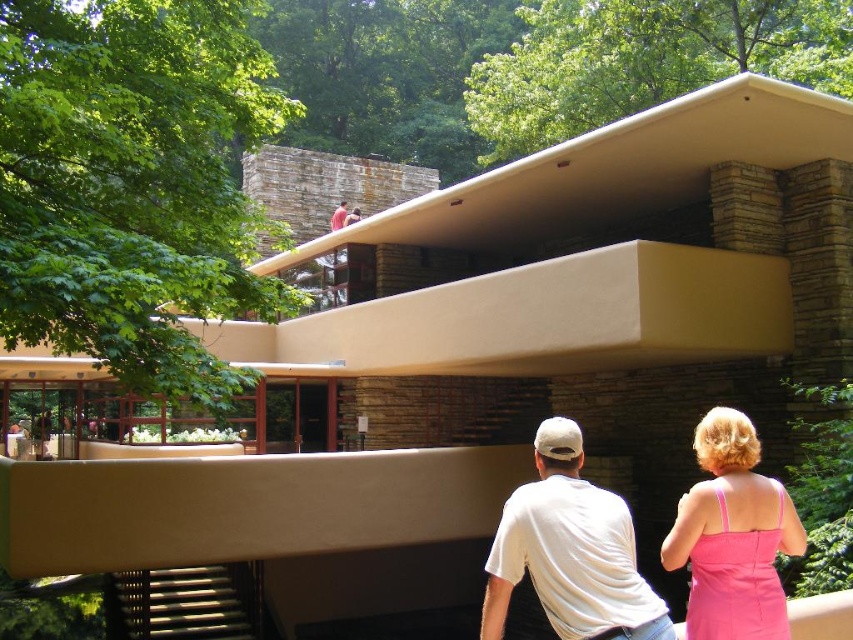
Question: Does white cotton shirt at center appear on the right side of matte stone man at upper center?

Choices:
 (A) yes
 (B) no

Answer: (A)

Question: Which object appears farthest from the camera in this image?

Choices:
 (A) pink satin dress at lower right
 (B) white cotton shirt at center
 (C) matte stone man at upper center

Answer: (C)

Question: Which point is closer to the camera taking this photo?

Choices:
 (A) (659, 602)
 (B) (750, 584)
 (C) (340, 209)

Answer: (A)

Question: Where is white cotton shirt at center located in relation to pink satin dress at lower right in the image?

Choices:
 (A) above
 (B) below

Answer: (B)

Question: Can you confirm if white cotton shirt at center is wider than matte stone man at upper center?

Choices:
 (A) yes
 (B) no

Answer: (A)

Question: Which point appears farthest from the camera in this image?

Choices:
 (A) (566, 497)
 (B) (762, 616)
 (C) (339, 225)

Answer: (C)